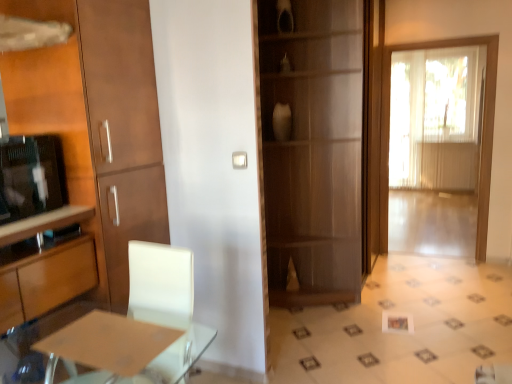
Locate an element on the screen. The image size is (512, 384). white sheer curtain at right is located at coordinates (435, 117).

In order to face matte wood cabinet at left, marked as the second cabinetry in a bottom-to-top arrangement, should I rotate leftwards or rightwards?

Rotate your view left by about 20.511°.

Where is `transparent glass door at right`? transparent glass door at right is located at coordinates (482, 136).

In order to face wooden cabinet at left, positioned as the second cabinetry in top-to-bottom order, should I rotate leftwards or rightwards?

You should rotate left by 28.914 degrees.

Measure the distance between point (25, 233) and camera.

A distance of 6.11 feet exists between point (25, 233) and camera.

Where is `white sheer curtain at right`? The width and height of the screenshot is (512, 384). white sheer curtain at right is located at coordinates (435, 117).

From the image's perspective, is matte brown table at lower left located beneath matte wood cabinet at left, the first cabinetry from the top?

Yes, from the image's perspective, matte brown table at lower left is beneath matte wood cabinet at left, the first cabinetry from the top.

Which is less distant, (x=138, y=350) or (x=74, y=15)?

The point (x=138, y=350) is more forward.

Looking at this image, is matte brown table at lower left positioned with its back to matte wood cabinet at left, marked as the second cabinetry in a bottom-to-top arrangement?

No, matte wood cabinet at left, marked as the second cabinetry in a bottom-to-top arrangement, is not at the back of matte brown table at lower left.

Does matte brown table at lower left appear on the right side of matte wood cabinet at left, the first cabinetry from the top?

Yes.

Between matte wood cabinet at left, the first cabinetry from the top, and white sheer curtain at right, which one appears on the left side from the viewer's perspective?

matte wood cabinet at left, the first cabinetry from the top.

Can you confirm if matte wood cabinet at left, the first cabinetry from the top, is wider than white sheer curtain at right?

Yes.

How many degrees apart are the facing directions of matte wood cabinet at left, the first cabinetry from the top, and white sheer curtain at right?

The facing directions of matte wood cabinet at left, the first cabinetry from the top, and white sheer curtain at right are 89.4 degrees apart.

Which of these two, matte wood cabinet at left, marked as the second cabinetry in a bottom-to-top arrangement, or white sheer curtain at right, is smaller?

matte wood cabinet at left, marked as the second cabinetry in a bottom-to-top arrangement, is smaller.

Is wooden cabinet at center to the left of matte wood cabinet at left, the first cabinetry from the top, from the viewer's perspective?

In fact, wooden cabinet at center is to the right of matte wood cabinet at left, the first cabinetry from the top.

From the image's perspective, is wooden cabinet at center below matte wood cabinet at left, marked as the second cabinetry in a bottom-to-top arrangement?

No, from the image's perspective, wooden cabinet at center is not beneath matte wood cabinet at left, marked as the second cabinetry in a bottom-to-top arrangement.

Is there a large distance between wooden cabinet at center and matte wood cabinet at left, marked as the second cabinetry in a bottom-to-top arrangement?

Yes, wooden cabinet at center and matte wood cabinet at left, marked as the second cabinetry in a bottom-to-top arrangement, are located far from each other.

Does point (358, 141) come in front of point (133, 46)?

No, it is not.

You are a GUI agent. You are given a task and a screenshot of the screen. Output one action in this format:
    pyautogui.click(x=<x>, y=<y>)
    Task: Click on the table positioned vertically above the wooden cabinet at left, arranged as the first cabinetry when ordered from the bottom (from a real-world perspective)
    The width and height of the screenshot is (512, 384).
    Given the screenshot: What is the action you would take?
    pyautogui.click(x=128, y=346)

Is wooden cabinet at left, positioned as the second cabinetry in top-to-bottom order, facing towards matte brown table at lower left?

Yes, wooden cabinet at left, positioned as the second cabinetry in top-to-bottom order, is turned towards matte brown table at lower left.

Is wooden cabinet at left, arranged as the first cabinetry when ordered from the bottom, wider or thinner than matte brown table at lower left?

wooden cabinet at left, arranged as the first cabinetry when ordered from the bottom, is wider than matte brown table at lower left.

Does wooden cabinet at left, positioned as the second cabinetry in top-to-bottom order, appear on the left side of matte brown table at lower left?

Correct, you'll find wooden cabinet at left, positioned as the second cabinetry in top-to-bottom order, to the left of matte brown table at lower left.

How far apart are matte wood cabinet at left, marked as the second cabinetry in a bottom-to-top arrangement, and wooden cabinet at center?

matte wood cabinet at left, marked as the second cabinetry in a bottom-to-top arrangement, is 1.31 meters from wooden cabinet at center.

How many degrees apart are the facing directions of matte wood cabinet at left, the first cabinetry from the top, and wooden cabinet at center?

They differ by 1.41 degrees in their facing directions.

Is matte wood cabinet at left, marked as the second cabinetry in a bottom-to-top arrangement, not close to wooden cabinet at center?

matte wood cabinet at left, marked as the second cabinetry in a bottom-to-top arrangement, is far away from wooden cabinet at center.

Is matte wood cabinet at left, the first cabinetry from the top, oriented towards wooden cabinet at center?

No, matte wood cabinet at left, the first cabinetry from the top, is not oriented towards wooden cabinet at center.

Which point is more forward, (42,132) or (464,41)?

The point (42,132) is closer to the camera.

The width and height of the screenshot is (512, 384). I want to click on door on the right of matte wood cabinet at left, the first cabinetry from the top, so click(482, 136).

Is matte wood cabinet at left, marked as the second cabinetry in a bottom-to-top arrangement, facing away from transparent glass door at right?

matte wood cabinet at left, marked as the second cabinetry in a bottom-to-top arrangement, does not have its back to transparent glass door at right.

Is matte wood cabinet at left, marked as the second cabinetry in a bottom-to-top arrangement, wider or thinner than transparent glass door at right?

matte wood cabinet at left, marked as the second cabinetry in a bottom-to-top arrangement, is wider than transparent glass door at right.

Considering the sizes of objects matte black television at left and white sheer curtain at right in the image provided, who is wider, matte black television at left or white sheer curtain at right?

With larger width is matte black television at left.

Considering the positions of points (22, 208) and (431, 95), is point (22, 208) closer to camera compared to point (431, 95)?

That is True.

In terms of size, does matte black television at left appear bigger or smaller than white sheer curtain at right?

In the image, matte black television at left appears to be smaller than white sheer curtain at right.

Identify the location of cabinetry positioned vertically above the matte brown table at lower left (from a real-world perspective). (97, 120).

The image size is (512, 384). I want to click on the 1st cabinetry to the left when counting from the white sheer curtain at right, so click(x=97, y=120).

Based on their spatial positions, is wooden cabinet at left, positioned as the second cabinetry in top-to-bottom order, or transparent glass door at right further from white sheer curtain at right?

wooden cabinet at left, positioned as the second cabinetry in top-to-bottom order, is further to white sheer curtain at right.

From the image, which object appears to be farther from matte brown table at lower left, wooden cabinet at left, positioned as the second cabinetry in top-to-bottom order, or matte wood cabinet at left, the first cabinetry from the top?

matte wood cabinet at left, the first cabinetry from the top.

From the image, which object appears to be nearer to wooden cabinet at center, white sheer curtain at right or matte black television at left?

matte black television at left is closer to wooden cabinet at center.

Estimate the real-world distances between objects in this image. Which object is closer to white sheer curtain at right, wooden cabinet at center or matte wood cabinet at left, the first cabinetry from the top?

Among the two, wooden cabinet at center is located nearer to white sheer curtain at right.

Which object lies nearer to the anchor point white sheer curtain at right, wooden cabinet at left, arranged as the first cabinetry when ordered from the bottom, or matte black television at left?

Among the two, matte black television at left is located nearer to white sheer curtain at right.

Based on their spatial positions, is matte wood cabinet at left, the first cabinetry from the top, or matte black television at left further from matte brown table at lower left?

matte wood cabinet at left, the first cabinetry from the top, is positioned further to the anchor matte brown table at lower left.

Considering their positions, is matte brown table at lower left positioned closer to white sheer curtain at right than matte black television at left?

Based on the image, matte brown table at lower left appears to be nearer to white sheer curtain at right.

Estimate the real-world distances between objects in this image. Which object is closer to matte brown table at lower left, matte wood cabinet at left, marked as the second cabinetry in a bottom-to-top arrangement, or wooden cabinet at center?

matte wood cabinet at left, marked as the second cabinetry in a bottom-to-top arrangement.

Locate an element on the screen. This screenshot has width=512, height=384. door positioned between matte wood cabinet at left, the first cabinetry from the top, and white sheer curtain at right from near to far is located at coordinates (482, 136).

You are a GUI agent. You are given a task and a screenshot of the screen. Output one action in this format:
    pyautogui.click(x=<x>, y=<y>)
    Task: Click on the table between matte black television at left and wooden cabinet at left, arranged as the first cabinetry when ordered from the bottom, from top to bottom
    
    Given the screenshot: What is the action you would take?
    pyautogui.click(x=128, y=346)

The height and width of the screenshot is (384, 512). Identify the location of table located between matte wood cabinet at left, marked as the second cabinetry in a bottom-to-top arrangement, and transparent glass door at right in the left-right direction. click(128, 346).

I want to click on table between matte black television at left and wooden cabinet at center, so click(128, 346).